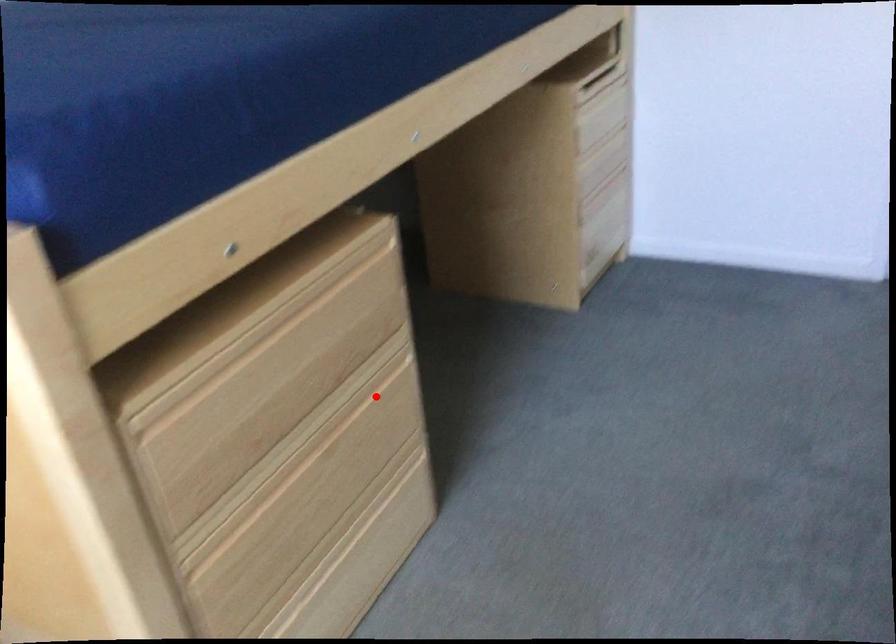
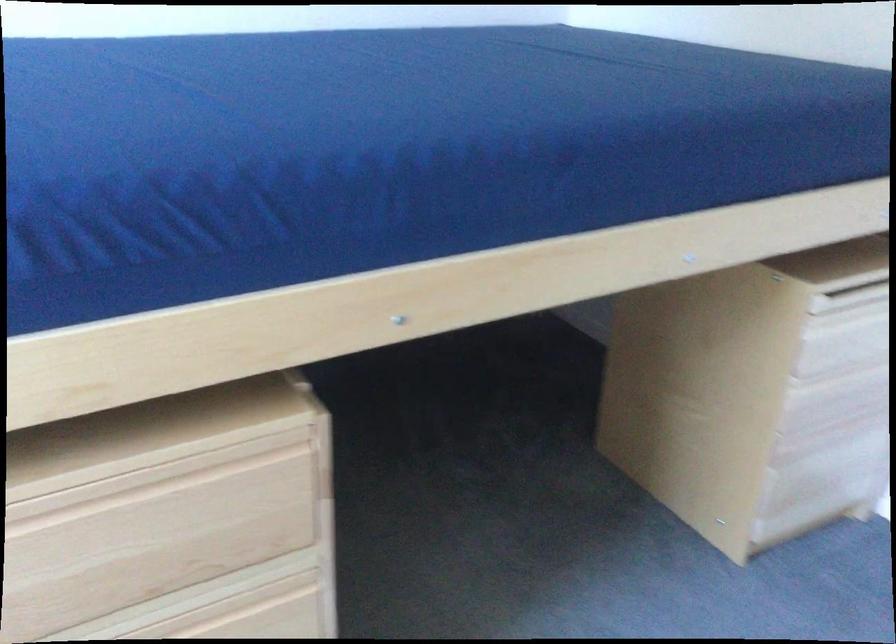
Question: A red point is marked in image1. In image2, is the corresponding 3D point closer to the camera or farther? Reply with the corresponding letter.

Choices:
 (A) The corresponding 3D point is closer.
 (B) The corresponding 3D point is farther.

Answer: (A)